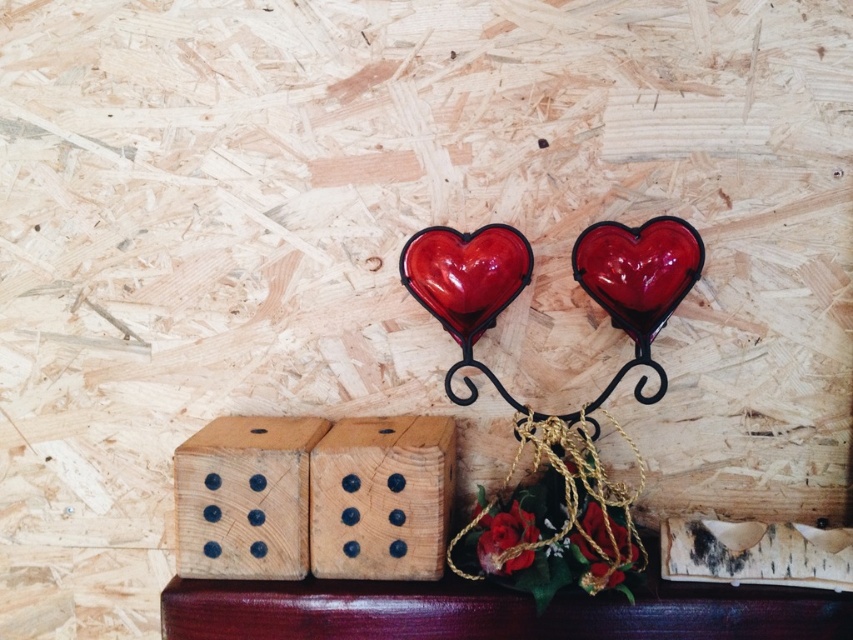
You are organizing a game night and have placed the natural wood domino at lower left and the glossy glass heart at center on a table. To ensure they don not get mixed up, which one is located to the left of the other?

The natural wood domino at lower left is positioned on the left side of glossy glass heart at center.

You are arranging items on a rustic wooden backdrop. You have a black birch wood at lower right and a glossy glass heart at center. Which object is closer to you?

The black birch wood at lower right is closer to you because it is in front of the glossy glass heart at center.

You are arranging items on a dark reddish brown wooden surface. You have a black birch wood at lower right and a glossy glass heart at center. Which object is positioned to the right of the other?

The black birch wood at lower right is positioned to the right of the glossy glass heart at center.